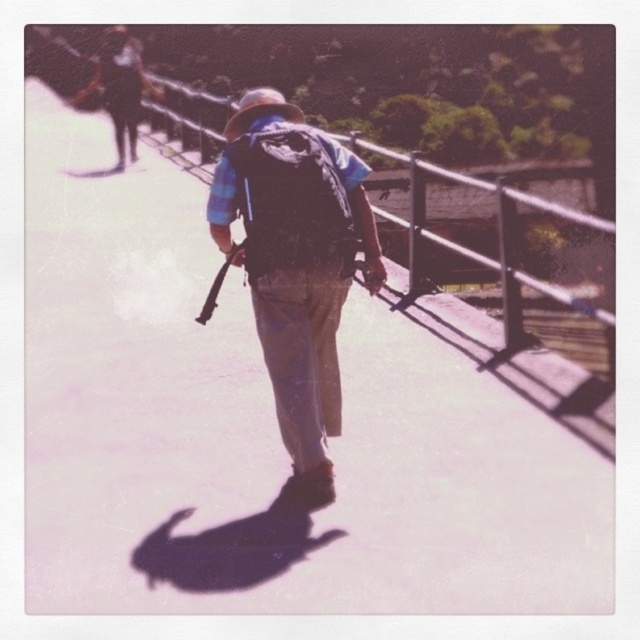
You are a hiker who just noticed two backpacks on the ground ahead of you. You see the matte blue backpack at center and the matte black backpack at center. Which one is positioned to the right when viewed from your perspective?

The matte blue backpack at center is positioned to the right of the matte black backpack at center.